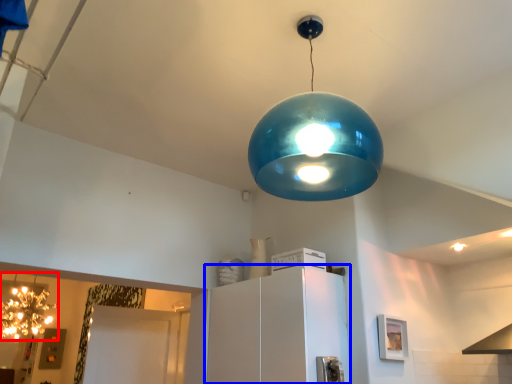
Question: Which object appears closest to the camera in this image, lamp (highlighted by a red box) or cabinetry (highlighted by a blue box)?

Choices:
 (A) lamp
 (B) cabinetry

Answer: (B)